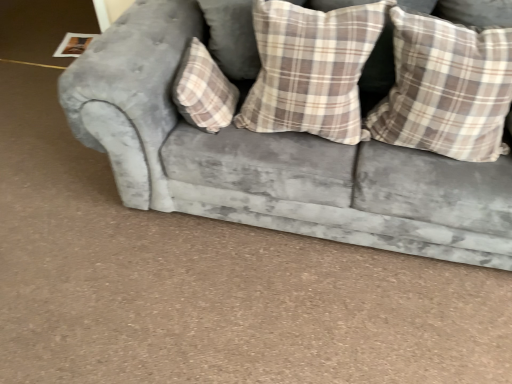
Measure the distance between point (x=192, y=106) and camera.

Point (x=192, y=106) and camera are 1.41 meters apart.

This screenshot has height=384, width=512. What do you see at coordinates (446, 88) in the screenshot?
I see `plaid fabric pillow at right, which appears as the 3th pillow when viewed from the left` at bounding box center [446, 88].

This screenshot has height=384, width=512. What are the coordinates of `plaid fabric pillow at right, positioned as the 1th pillow in right-to-left order` in the screenshot? It's located at (446, 88).

What do you see at coordinates (272, 158) in the screenshot? This screenshot has height=384, width=512. I see `velvet gray couch at center` at bounding box center [272, 158].

Where is `plaid fabric pillow at center, the 1th pillow positioned from the left`? The image size is (512, 384). plaid fabric pillow at center, the 1th pillow positioned from the left is located at coordinates (203, 90).

From a real-world perspective, is velvet gray couch at center below plaid fabric pillow at right, positioned as the 1th pillow in right-to-left order?

Yes.

Could you tell me if velvet gray couch at center is facing plaid fabric pillow at right, positioned as the 1th pillow in right-to-left order?

Yes, velvet gray couch at center is facing plaid fabric pillow at right, positioned as the 1th pillow in right-to-left order.

Is the surface of velvet gray couch at center in direct contact with plaid fabric pillow at right, positioned as the 1th pillow in right-to-left order?

There is a gap between velvet gray couch at center and plaid fabric pillow at right, positioned as the 1th pillow in right-to-left order.

Who is shorter, velvet gray couch at center or plaid fabric pillow at right, positioned as the 1th pillow in right-to-left order?

Standing shorter between the two is plaid fabric pillow at right, positioned as the 1th pillow in right-to-left order.

Is plaid fabric pillow at right, which appears as the 3th pillow when viewed from the left, oriented away from plaid fabric pillow at center, arranged as the 2th pillow when viewed from the right?

No.

From the picture: Between plaid fabric pillow at right, positioned as the 1th pillow in right-to-left order, and plaid fabric pillow at center, acting as the 2th pillow starting from the left, which one has smaller size?

With smaller size is plaid fabric pillow at center, acting as the 2th pillow starting from the left.

Is plaid fabric pillow at right, positioned as the 1th pillow in right-to-left order, at the left side of plaid fabric pillow at center, arranged as the 2th pillow when viewed from the right?

Incorrect, plaid fabric pillow at right, positioned as the 1th pillow in right-to-left order, is not on the left side of plaid fabric pillow at center, arranged as the 2th pillow when viewed from the right.

From the image's perspective, between plaid fabric pillow at center, positioned as the third pillow in right-to-left order, and plaid fabric pillow at center, arranged as the 2th pillow when viewed from the right, who is located below?

plaid fabric pillow at center, positioned as the third pillow in right-to-left order, from the image's perspective.

Find the location of a particular element. the 1st pillow below when counting from the plaid fabric pillow at center, arranged as the 2th pillow when viewed from the right (from the image's perspective) is located at coordinates (203, 90).

Does plaid fabric pillow at center, the 1th pillow positioned from the left, have a smaller size compared to plaid fabric pillow at center, arranged as the 2th pillow when viewed from the right?

Yes.

Is plaid fabric pillow at center, positioned as the third pillow in right-to-left order, next to plaid fabric pillow at center, acting as the 2th pillow starting from the left?

No, plaid fabric pillow at center, positioned as the third pillow in right-to-left order, is not next to plaid fabric pillow at center, acting as the 2th pillow starting from the left.

From a real-world perspective, relative to plaid fabric pillow at center, the 1th pillow positioned from the left, is plaid fabric pillow at center, acting as the 2th pillow starting from the left, vertically above or below?

plaid fabric pillow at center, acting as the 2th pillow starting from the left, is above plaid fabric pillow at center, the 1th pillow positioned from the left.

Can you confirm if plaid fabric pillow at center, arranged as the 2th pillow when viewed from the right, is shorter than plaid fabric pillow at center, positioned as the third pillow in right-to-left order?

No.

Considering the positions of point (313, 73) and point (190, 88), is point (313, 73) closer or farther from the camera than point (190, 88)?

Point (313, 73) appears to be closer to the viewer than point (190, 88).

In terms of size, does plaid fabric pillow at center, arranged as the 2th pillow when viewed from the right, appear bigger or smaller than plaid fabric pillow at center, the 1th pillow positioned from the left?

Considering their sizes, plaid fabric pillow at center, arranged as the 2th pillow when viewed from the right, takes up more space than plaid fabric pillow at center, the 1th pillow positioned from the left.

The height and width of the screenshot is (384, 512). Find the location of `pillow that is the 2nd one when counting forward from the plaid fabric pillow at center, the 1th pillow positioned from the left`. pillow that is the 2nd one when counting forward from the plaid fabric pillow at center, the 1th pillow positioned from the left is located at coordinates (446, 88).

From a real-world perspective, relative to plaid fabric pillow at center, the 1th pillow positioned from the left, is plaid fabric pillow at right, which appears as the 3th pillow when viewed from the left, vertically above or below?

plaid fabric pillow at right, which appears as the 3th pillow when viewed from the left, is situated higher than plaid fabric pillow at center, the 1th pillow positioned from the left, in the real world.

Is plaid fabric pillow at right, which appears as the 3th pillow when viewed from the left, positioned before plaid fabric pillow at center, the 1th pillow positioned from the left?

Yes, it is in front of plaid fabric pillow at center, the 1th pillow positioned from the left.

Is velvet gray couch at center placed right next to plaid fabric pillow at center, the 1th pillow positioned from the left?

No, velvet gray couch at center is not touching plaid fabric pillow at center, the 1th pillow positioned from the left.

From the image's perspective, is velvet gray couch at center located beneath plaid fabric pillow at center, positioned as the third pillow in right-to-left order?

No.

Does velvet gray couch at center contain plaid fabric pillow at center, the 1th pillow positioned from the left?

Absolutely, plaid fabric pillow at center, the 1th pillow positioned from the left, is inside velvet gray couch at center.

Between velvet gray couch at center and plaid fabric pillow at center, positioned as the third pillow in right-to-left order, which one has larger size?

Bigger between the two is velvet gray couch at center.

Is plaid fabric pillow at center, the 1th pillow positioned from the left, thinner than plaid fabric pillow at right, which appears as the 3th pillow when viewed from the left?

Indeed, plaid fabric pillow at center, the 1th pillow positioned from the left, has a lesser width compared to plaid fabric pillow at right, which appears as the 3th pillow when viewed from the left.

Which is closer, (203,104) or (431,38)?

Point (203,104).

Can you tell me how much plaid fabric pillow at center, the 1th pillow positioned from the left, and plaid fabric pillow at right, positioned as the 1th pillow in right-to-left order, differ in facing direction?

The angular difference between plaid fabric pillow at center, the 1th pillow positioned from the left, and plaid fabric pillow at right, positioned as the 1th pillow in right-to-left order, is 90 degrees.

Does plaid fabric pillow at center, positioned as the third pillow in right-to-left order, turn towards plaid fabric pillow at right, which appears as the 3th pillow when viewed from the left?

Yes, plaid fabric pillow at center, positioned as the third pillow in right-to-left order, faces towards plaid fabric pillow at right, which appears as the 3th pillow when viewed from the left.

From a real-world perspective, which pillow is the 3rd one above the velvet gray couch at center? Please provide its 2D coordinates.

[(446, 88)]

Image resolution: width=512 pixels, height=384 pixels. I want to click on pillow that is the 1st one when counting leftward from the plaid fabric pillow at right, which appears as the 3th pillow when viewed from the left, so click(x=311, y=69).

Considering their positions, is plaid fabric pillow at right, which appears as the 3th pillow when viewed from the left, positioned closer to plaid fabric pillow at center, acting as the 2th pillow starting from the left, than plaid fabric pillow at center, positioned as the third pillow in right-to-left order?

Among the two, plaid fabric pillow at right, which appears as the 3th pillow when viewed from the left, is located nearer to plaid fabric pillow at center, acting as the 2th pillow starting from the left.

Which object lies further to the anchor point plaid fabric pillow at center, positioned as the third pillow in right-to-left order, plaid fabric pillow at right, positioned as the 1th pillow in right-to-left order, or plaid fabric pillow at center, arranged as the 2th pillow when viewed from the right?

The object further to plaid fabric pillow at center, positioned as the third pillow in right-to-left order, is plaid fabric pillow at right, positioned as the 1th pillow in right-to-left order.

Based on their spatial positions, is plaid fabric pillow at center, arranged as the 2th pillow when viewed from the right, or plaid fabric pillow at right, positioned as the 1th pillow in right-to-left order, closer to plaid fabric pillow at center, positioned as the third pillow in right-to-left order?

plaid fabric pillow at center, arranged as the 2th pillow when viewed from the right, is closer to plaid fabric pillow at center, positioned as the third pillow in right-to-left order.

When comparing their distances from plaid fabric pillow at right, which appears as the 3th pillow when viewed from the left, does velvet gray couch at center or plaid fabric pillow at center, positioned as the third pillow in right-to-left order, seem further?

The object further to plaid fabric pillow at right, which appears as the 3th pillow when viewed from the left, is plaid fabric pillow at center, positioned as the third pillow in right-to-left order.

Looking at the image, which one is located further to velvet gray couch at center, plaid fabric pillow at center, the 1th pillow positioned from the left, or plaid fabric pillow at right, which appears as the 3th pillow when viewed from the left?

plaid fabric pillow at right, which appears as the 3th pillow when viewed from the left, lies further to velvet gray couch at center than the other object.

When comparing their distances from plaid fabric pillow at center, the 1th pillow positioned from the left, does velvet gray couch at center or plaid fabric pillow at center, arranged as the 2th pillow when viewed from the right, seem further?

Among the two, velvet gray couch at center is located further to plaid fabric pillow at center, the 1th pillow positioned from the left.

Which object lies nearer to the anchor point plaid fabric pillow at center, arranged as the 2th pillow when viewed from the right, plaid fabric pillow at center, positioned as the third pillow in right-to-left order, or velvet gray couch at center?

plaid fabric pillow at center, positioned as the third pillow in right-to-left order, is positioned closer to the anchor plaid fabric pillow at center, arranged as the 2th pillow when viewed from the right.

Estimate the real-world distances between objects in this image. Which object is further from velvet gray couch at center, plaid fabric pillow at center, acting as the 2th pillow starting from the left, or plaid fabric pillow at center, the 1th pillow positioned from the left?

Based on the image, plaid fabric pillow at center, the 1th pillow positioned from the left, appears to be further to velvet gray couch at center.

In order to click on studio couch between plaid fabric pillow at center, the 1th pillow positioned from the left, and plaid fabric pillow at right, which appears as the 3th pillow when viewed from the left, in the horizontal direction in this screenshot , I will do `click(272, 158)`.

Locate an element on the screen. The width and height of the screenshot is (512, 384). pillow situated between plaid fabric pillow at center, the 1th pillow positioned from the left, and velvet gray couch at center from left to right is located at coordinates (311, 69).

Image resolution: width=512 pixels, height=384 pixels. I want to click on pillow between plaid fabric pillow at center, positioned as the third pillow in right-to-left order, and plaid fabric pillow at right, positioned as the 1th pillow in right-to-left order, in the horizontal direction, so click(311, 69).

Where is `studio couch between plaid fabric pillow at center, acting as the 2th pillow starting from the left, and plaid fabric pillow at right, which appears as the 3th pillow when viewed from the left, in the horizontal direction`? The height and width of the screenshot is (384, 512). studio couch between plaid fabric pillow at center, acting as the 2th pillow starting from the left, and plaid fabric pillow at right, which appears as the 3th pillow when viewed from the left, in the horizontal direction is located at coordinates pyautogui.click(x=272, y=158).